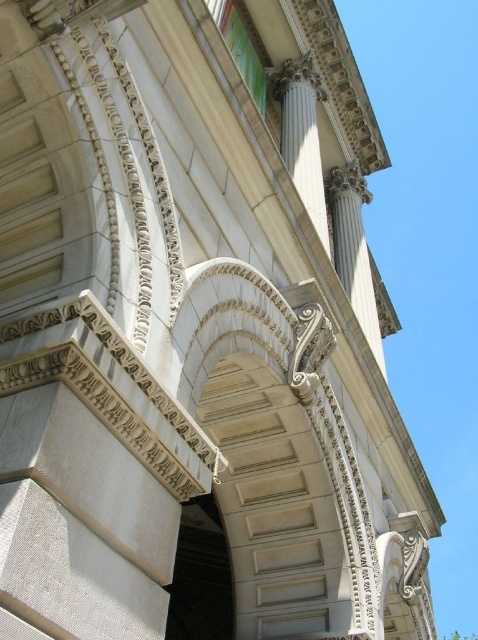
Between white stone archway at center and dark gray stone arch at center, which one appears on the left side from the viewer's perspective?

From the viewer's perspective, dark gray stone arch at center appears more on the left side.

Can you confirm if white stone archway at center is smaller than dark gray stone arch at center?

Indeed, white stone archway at center has a smaller size compared to dark gray stone arch at center.

I want to click on white stone archway at center, so click(x=279, y=454).

You are a GUI agent. You are given a task and a screenshot of the screen. Output one action in this format:
    pyautogui.click(x=<x>, y=<y>)
    Task: Click on the white stone archway at center
    The width and height of the screenshot is (478, 640).
    Given the screenshot: What is the action you would take?
    pyautogui.click(x=279, y=454)

Is dark gray stone arch at center bigger than white marble column at center?

Indeed, dark gray stone arch at center has a larger size compared to white marble column at center.

The width and height of the screenshot is (478, 640). Describe the element at coordinates (201, 576) in the screenshot. I see `dark gray stone arch at center` at that location.

At what (x,y) coordinates should I click in order to perform the action: click on dark gray stone arch at center. Please return your answer as a coordinate pair (x, y). Looking at the image, I should click on (201, 576).

Is white marble column at center below white marble column at upper right?

No.

Is white marble column at center behind white marble column at upper right?

No.

Describe the element at coordinates (303, 134) in the screenshot. I see `white marble column at center` at that location.

Find the location of a particular element. The height and width of the screenshot is (640, 478). white marble column at center is located at coordinates (303, 134).